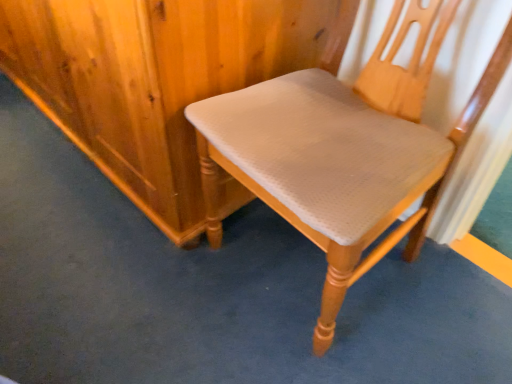
I want to click on vacant region below light brown wood chair at center (from a real-world perspective), so click(x=289, y=266).